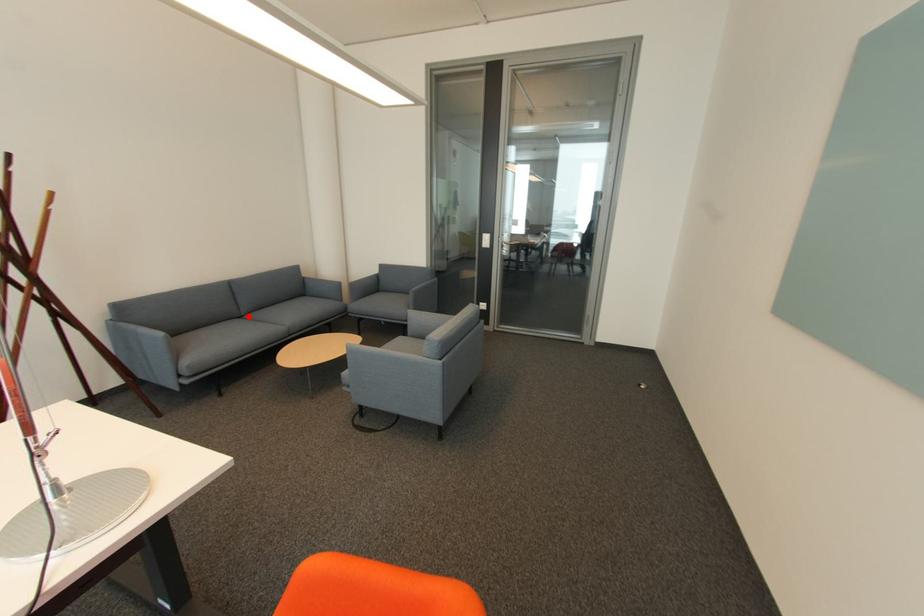
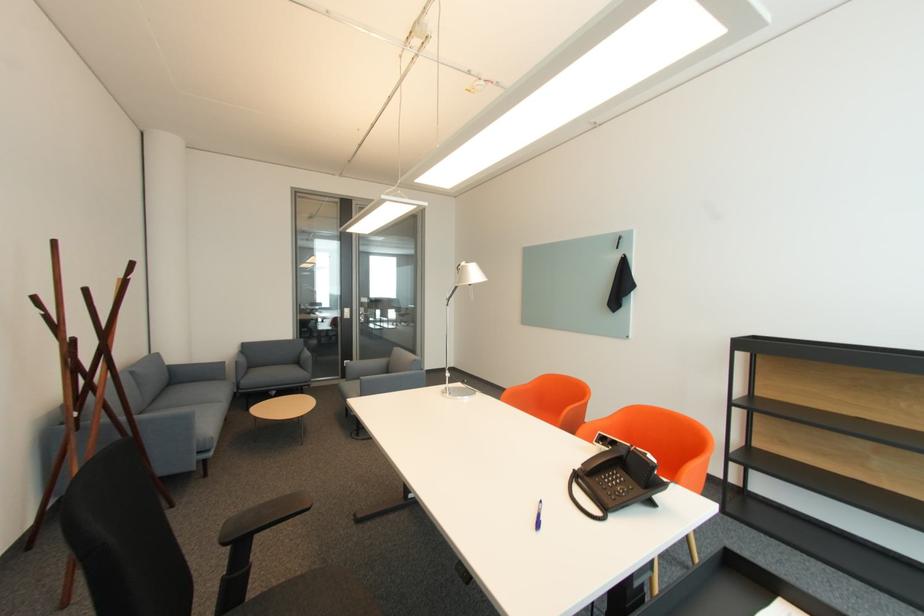
Locate, in the second image, the point that corresponds to the highlighted location in the first image.

(151, 411)